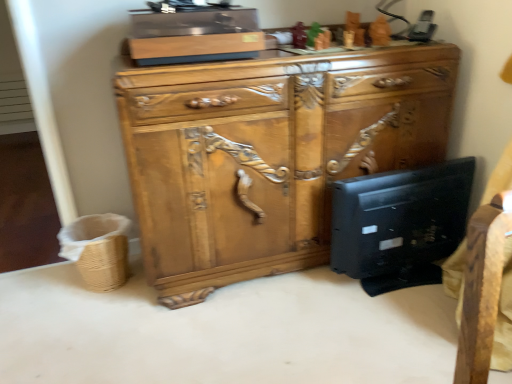
In order to click on vacant space situated on the left part of woven brown basket at lower left in this screenshot , I will do `click(50, 279)`.